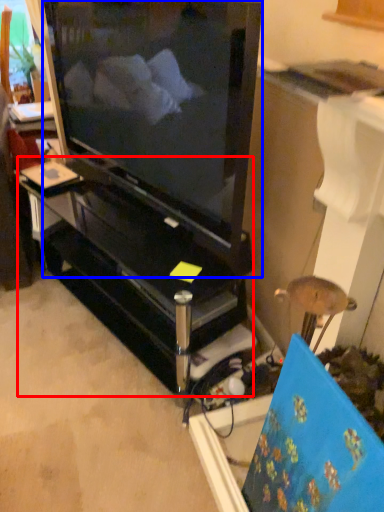
Question: Which of the following is the closest to the observer, furniture (highlighted by a red box) or television (highlighted by a blue box)?

Choices:
 (A) furniture
 (B) television

Answer: (B)